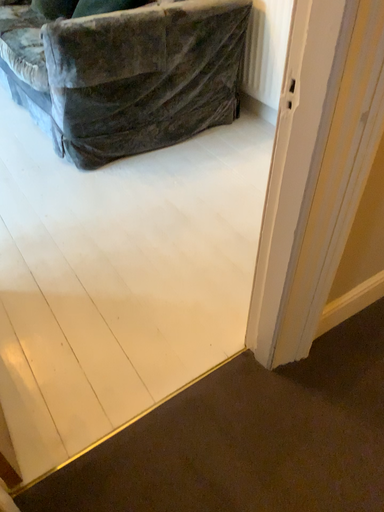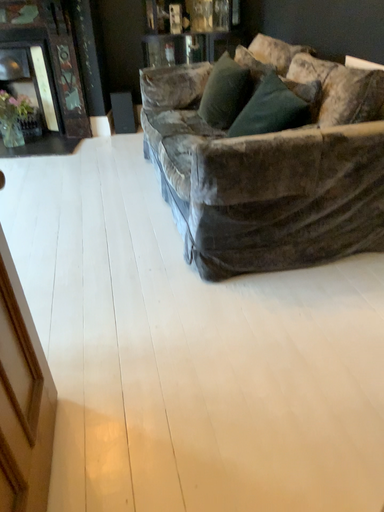
Question: Which way did the camera rotate in the video?

Choices:
 (A) rotated left
 (B) rotated right

Answer: (A)